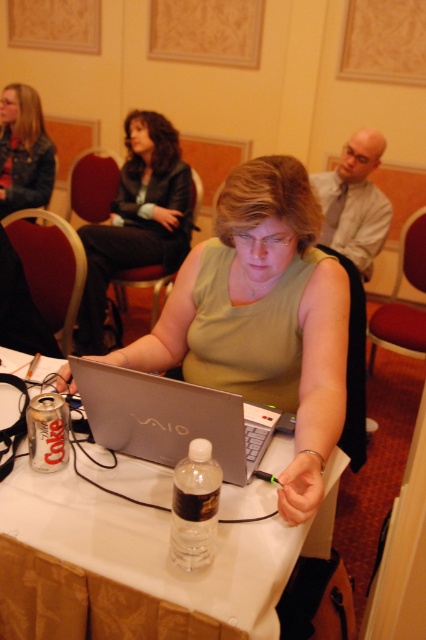
Which of these two, silver metallic laptop at center or matte black jacket at upper left, stands taller?

matte black jacket at upper left is taller.

What do you see at coordinates (170, 419) in the screenshot? The width and height of the screenshot is (426, 640). I see `silver metallic laptop at center` at bounding box center [170, 419].

Describe the element at coordinates (170, 419) in the screenshot. This screenshot has height=640, width=426. I see `silver metallic laptop at center` at that location.

This screenshot has height=640, width=426. Find the location of `silver metallic laptop at center`. silver metallic laptop at center is located at coordinates (170, 419).

Can you confirm if silver metallic laptop at center is shorter than green matte shirt at center?

Yes.

Which is below, silver metallic laptop at center or green matte shirt at center?

Positioned lower is silver metallic laptop at center.

Image resolution: width=426 pixels, height=640 pixels. What do you see at coordinates (170, 419) in the screenshot?
I see `silver metallic laptop at center` at bounding box center [170, 419].

The image size is (426, 640). What are the coordinates of `silver metallic laptop at center` in the screenshot? It's located at (170, 419).

Based on the photo, can you confirm if white plastic table at center is wider than matte black jacket at upper left?

Indeed, white plastic table at center has a greater width compared to matte black jacket at upper left.

Between white plastic table at center and matte black jacket at upper left, which one is positioned higher?

matte black jacket at upper left is higher up.

Image resolution: width=426 pixels, height=640 pixels. What are the coordinates of `white plastic table at center` in the screenshot? It's located at (150, 561).

You are a GUI agent. You are given a task and a screenshot of the screen. Output one action in this format:
    pyautogui.click(x=<x>, y=<y>)
    Task: Click on the white plastic table at center
    
    Given the screenshot: What is the action you would take?
    pyautogui.click(x=150, y=561)